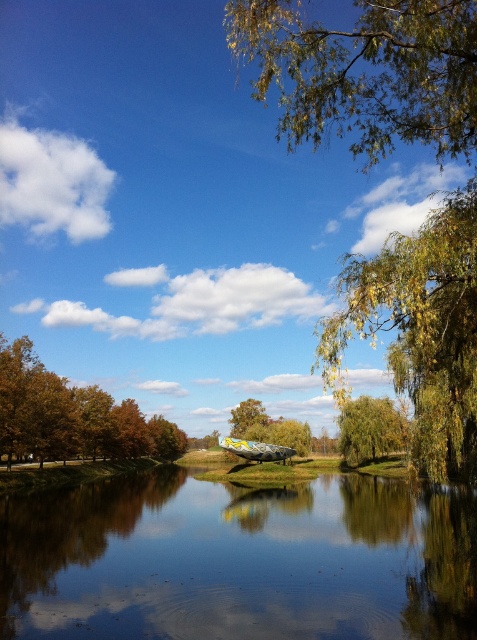
Can you confirm if green leafy branches at upper center is taller than green matte tree at center?

Yes.

Who is more distant from viewer, (311,129) or (261,410)?

The point (261,410) is behind.

What do you see at coordinates (365, 72) in the screenshot? I see `green leafy branches at upper center` at bounding box center [365, 72].

The height and width of the screenshot is (640, 477). I want to click on green leafy branches at upper center, so click(x=365, y=72).

Does green leafy branches at upper center have a greater width compared to yellow-green leaves at upper right?

Yes, green leafy branches at upper center is wider than yellow-green leaves at upper right.

Which is more to the right, green leafy branches at upper center or yellow-green leaves at upper right?

yellow-green leaves at upper right is more to the right.

Which is in front, point (444, 92) or point (475, 292)?

Positioned in front is point (444, 92).

What are the coordinates of `green leafy branches at upper center` in the screenshot? It's located at (365, 72).

Between point (120, 509) and point (238, 3), which one is positioned in front?

Positioned in front is point (238, 3).

Is point (386, 566) positioned behind point (293, 16)?

Yes, it is.

Identify the location of smooth reflective water at center. This screenshot has height=640, width=477. (238, 561).